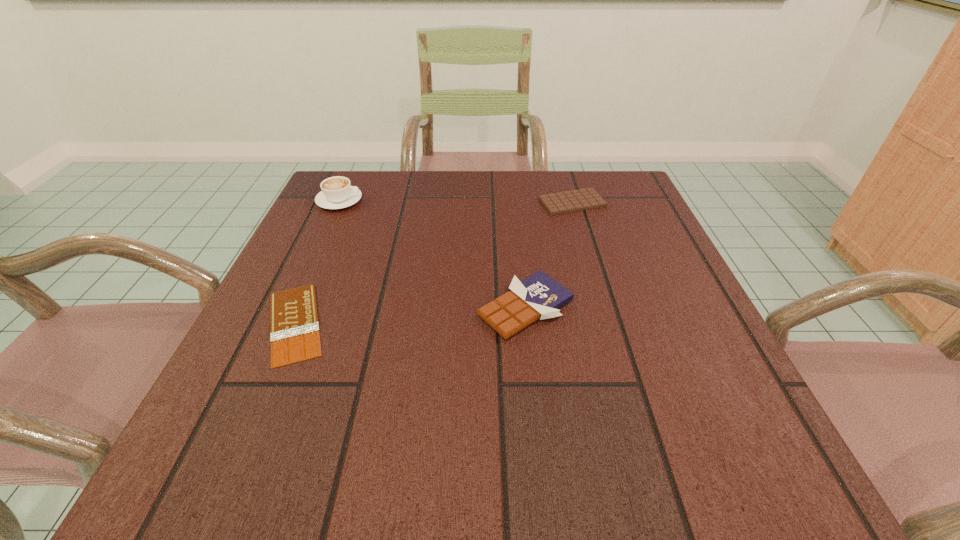
What are the coordinates of `vacant area in the image that satisfies the following two spatial constraints: 1. on the side of the tallest object with the handle; 2. on the back side of the farthest chocolate bar` in the screenshot? It's located at (339, 202).

You are a GUI agent. You are given a task and a screenshot of the screen. Output one action in this format:
    pyautogui.click(x=<x>, y=<y>)
    Task: Click on the vacant area that satisfies the following two spatial constraints: 1. on the side of the tallest chocolate bar with the handle; 2. on the left side of the tallest object
    
    Given the screenshot: What is the action you would take?
    pyautogui.click(x=290, y=308)

Where is `free space that satisfies the following two spatial constraints: 1. on the side of the leftmost chocolate bar with the handle; 2. on the left side of the tallest object`? This screenshot has width=960, height=540. free space that satisfies the following two spatial constraints: 1. on the side of the leftmost chocolate bar with the handle; 2. on the left side of the tallest object is located at coordinates (283, 323).

You are a GUI agent. You are given a task and a screenshot of the screen. Output one action in this format:
    pyautogui.click(x=<x>, y=<y>)
    Task: Click on the vacant region that satisfies the following two spatial constraints: 1. on the side of the tallest object with the handle; 2. on the left side of the shortest chocolate bar
    The image size is (960, 540).
    Given the screenshot: What is the action you would take?
    pyautogui.click(x=283, y=323)

The width and height of the screenshot is (960, 540). In order to click on vacant region that satisfies the following two spatial constraints: 1. on the side of the tallest object with the handle; 2. on the left side of the farthest chocolate bar in this screenshot , I will do `click(339, 202)`.

Find the location of a particular element. free space that satisfies the following two spatial constraints: 1. on the side of the tallest object with the handle; 2. on the right side of the shortest object is located at coordinates (283, 323).

Identify the location of free spot that satisfies the following two spatial constraints: 1. on the back side of the tallest chocolate bar; 2. on the left side of the shortest object. The image size is (960, 540). (301, 308).

Where is `vacant point that satisfies the following two spatial constraints: 1. on the side of the shortest object with the handle; 2. on the right side of the tallest object`? This screenshot has width=960, height=540. vacant point that satisfies the following two spatial constraints: 1. on the side of the shortest object with the handle; 2. on the right side of the tallest object is located at coordinates (283, 323).

Image resolution: width=960 pixels, height=540 pixels. I want to click on vacant space that satisfies the following two spatial constraints: 1. on the side of the third tallest object with the handle; 2. on the right side of the tallest object, so click(339, 202).

Find the location of a particular element. The width and height of the screenshot is (960, 540). vacant space that satisfies the following two spatial constraints: 1. on the back side of the third shortest object; 2. on the side of the tallest object with the handle is located at coordinates (514, 200).